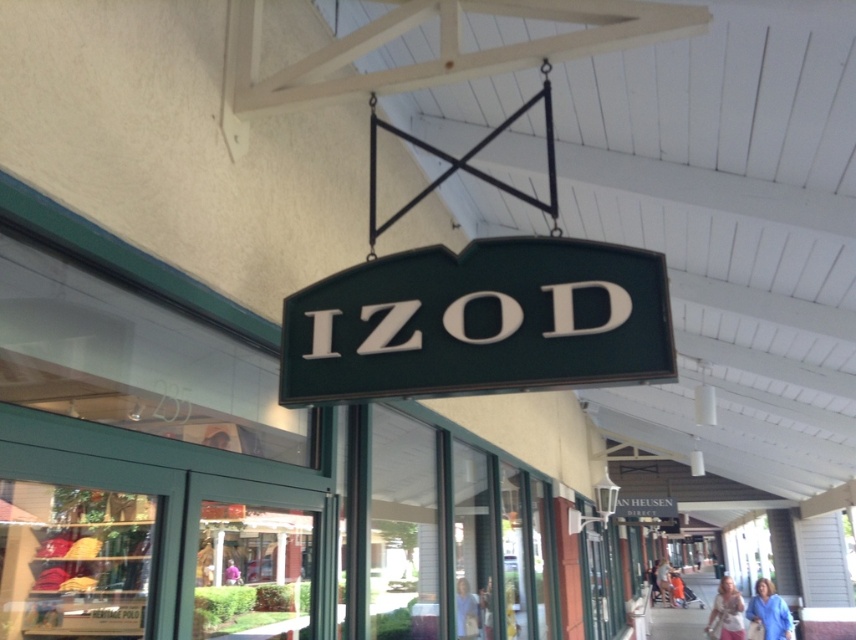
Question: Considering the relative positions of light blue shirt at center and denim jacket at lower right in the image provided, where is light blue shirt at center located with respect to denim jacket at lower right?

Choices:
 (A) below
 (B) above

Answer: (B)

Question: Does light blue shirt at center appear over light beige blouse at lower right?

Choices:
 (A) yes
 (B) no

Answer: (A)

Question: Estimate the real-world distances between objects in this image. Which object is closer to the light beige blouse at lower right?

Choices:
 (A) light blue shirt at center
 (B) pink fabric at center
 (C) green matte sign at center
 (D) blue cotton shirt at lower right

Answer: (D)

Question: Among these points, which one is nearest to the camera?

Choices:
 (A) (379, 316)
 (B) (776, 596)
 (C) (718, 586)
 (D) (663, 566)

Answer: (A)

Question: Which object is positioned closest to the green matte sign at center?

Choices:
 (A) light blue shirt at center
 (B) denim jacket at lower right
 (C) blue cotton shirt at lower right
 (D) light beige blouse at lower right

Answer: (A)

Question: Observing the image, what is the correct spatial positioning of light blue shirt at center in reference to pink fabric at center?

Choices:
 (A) left
 (B) right

Answer: (B)